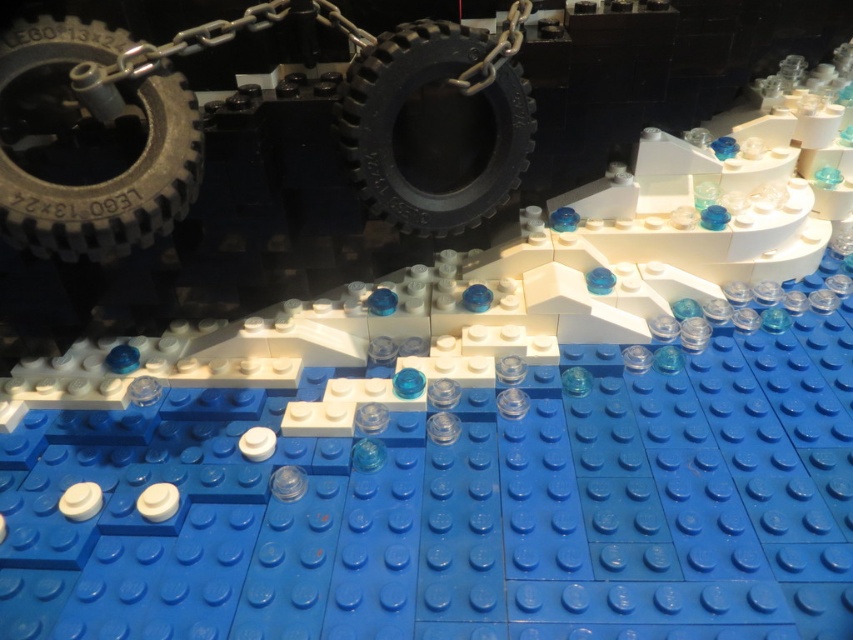
You are holding a camera 1.5 meters away from the LEGO construction. You want to focus on the point at coordinates point (149, 205). Is the point within your camera focus range if the camera can focus as close as 0.5 meters and as far as 2 meters?

The distance of point (149, 205) from the camera is 1.04 meters, which is within the camera focus range of 0.5 to 2 meters. Therefore, the point at point (149, 205) is within the focus range.

You are a LEGO builder trying to assemble a vehicle. You have two tires in the image, the dark gray rubber tire at upper left and the black rubber tire at center. Which tire is closer to you?

The dark gray rubber tire at upper left is closer to you because it is in front of the black rubber tire at center.